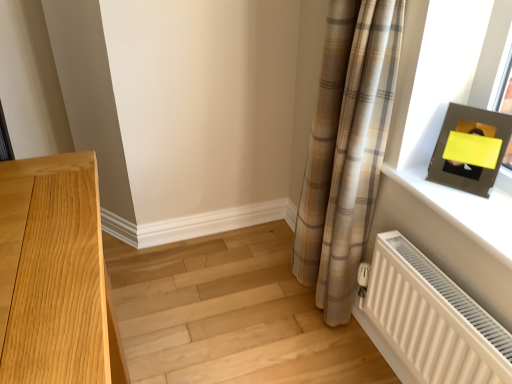
Question: Is matte black frame at upper right taller or shorter than light wood floor at lower left?

Choices:
 (A) tall
 (B) short

Answer: (A)

Question: From a real-world perspective, is matte black frame at upper right physically located above or below light wood floor at lower left?

Choices:
 (A) above
 (B) below

Answer: (A)

Question: Which object is positioned farthest from the white ribbed radiator at lower right?

Choices:
 (A) light wood floor at lower left
 (B) matte black picture frame at upper right
 (C) matte black frame at upper right
 (D) plaid fabric curtain at right

Answer: (A)

Question: Based on their relative distances, which object is nearer to the matte black frame at upper right?

Choices:
 (A) light wood floor at lower left
 (B) plaid fabric curtain at right
 (C) white ribbed radiator at lower right
 (D) matte black picture frame at upper right

Answer: (D)